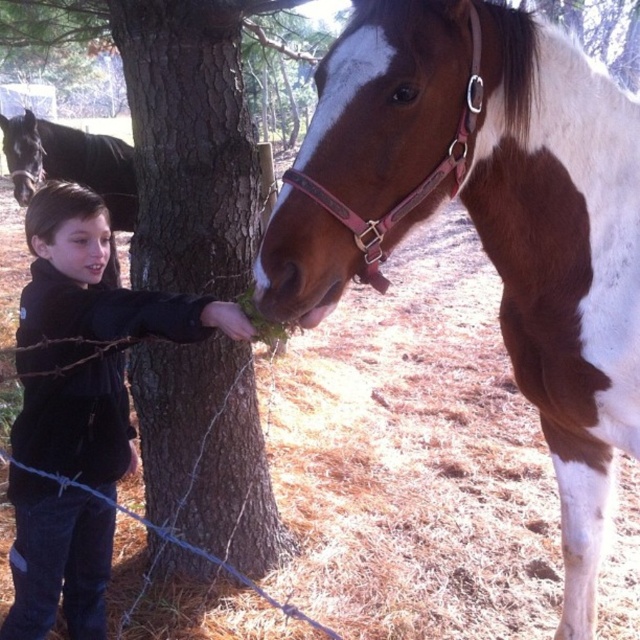
You are a photographer trying to capture the boy and the horse in the scene. You notice two points marked in the image. The first point is at coordinate point (468, 182), and the second is at point (49, 125). Which point is closer to you?

Point (468, 182) is closer to the viewer than point (49, 125).

You are a photographer standing 10 feet away from the brown rough bark tree at center. You want to take a photo of the shiny black horse at left without the tree in the frame. Is the distance between the tree and the horse sufficient for you to move closer to the tree and still capture the horse in the shot?

The brown rough bark tree at center is 8.98 feet from the shiny black horse at left. Since you are 10 feet away from the tree, moving closer to the tree would bring you within the 8.98 feet distance between them. This might place the horse just beyond your new position, so you need to ensure your camera lens can capture the horse from that proximity without the tree blocking the view. Alternatively, moving sideways around the tree could provide a clearer angle.